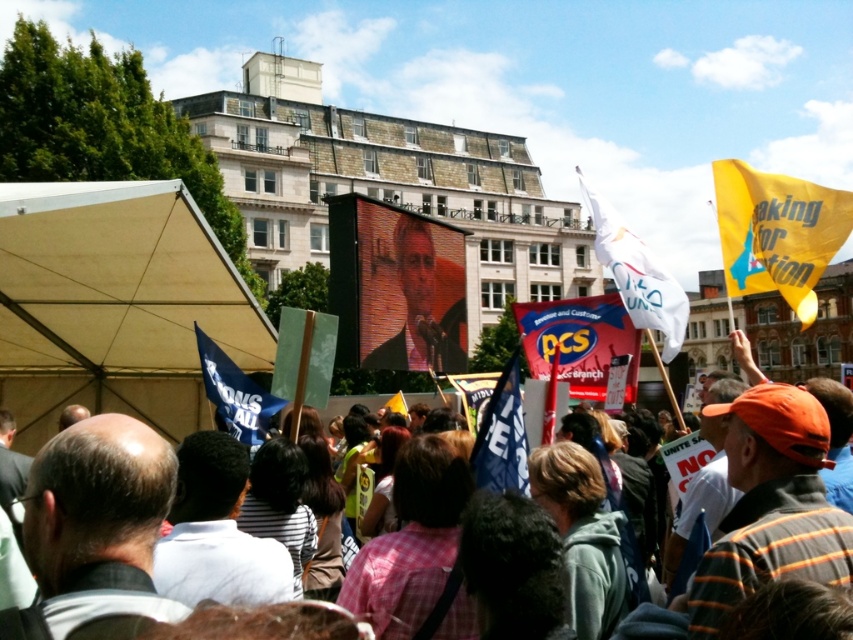
Between smooth skin face at center and yellow fabric flag at upper right, which one has less height?

With less height is smooth skin face at center.

Is smooth skin face at center further to camera compared to yellow fabric flag at upper right?

Yes.

Find the location of a particular element. The image size is (853, 640). smooth skin face at center is located at coordinates (409, 291).

You are a GUI agent. You are given a task and a screenshot of the screen. Output one action in this format:
    pyautogui.click(x=<x>, y=<y>)
    Task: Click on the smooth skin face at center
    
    Given the screenshot: What is the action you would take?
    pyautogui.click(x=409, y=291)

How much distance is there between pink fabric banner at center and white fabric flag at upper right?

pink fabric banner at center is 7.57 meters from white fabric flag at upper right.

Does pink fabric banner at center appear over white fabric flag at upper right?

No, pink fabric banner at center is not above white fabric flag at upper right.

Which is behind, point (599, 378) or point (683, 320)?

Point (599, 378)

At what (x,y) coordinates should I click in order to perform the action: click on pink fabric banner at center. Please return your answer as a coordinate pair (x, y). The width and height of the screenshot is (853, 640). Looking at the image, I should click on (579, 340).

Describe the element at coordinates (409, 291) in the screenshot. I see `smooth skin face at center` at that location.

Is smooth skin face at center positioned in front of pink fabric banner at center?

No, it is behind pink fabric banner at center.

Find the location of a particular element. This screenshot has height=640, width=853. smooth skin face at center is located at coordinates (409, 291).

Where is `smooth skin face at center`? This screenshot has width=853, height=640. smooth skin face at center is located at coordinates (409, 291).